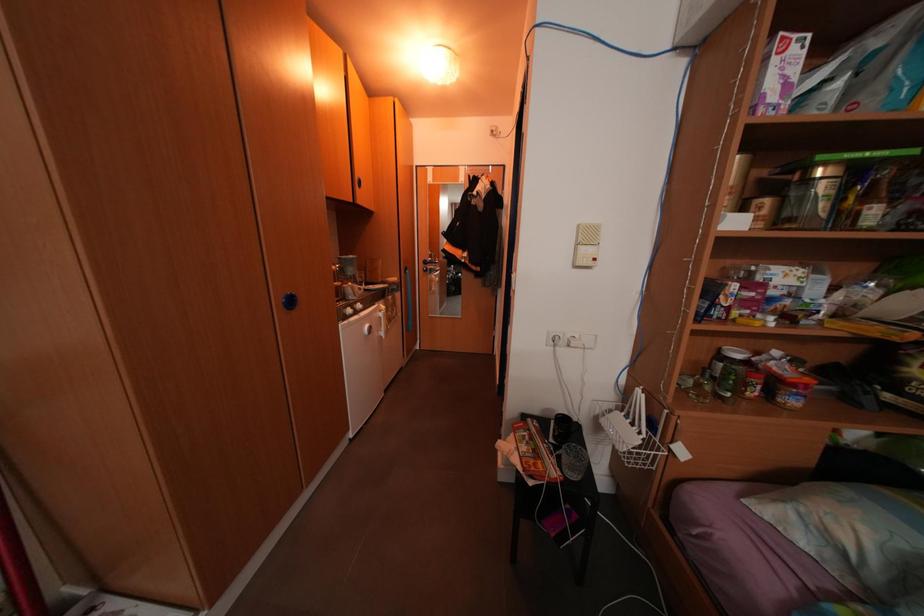
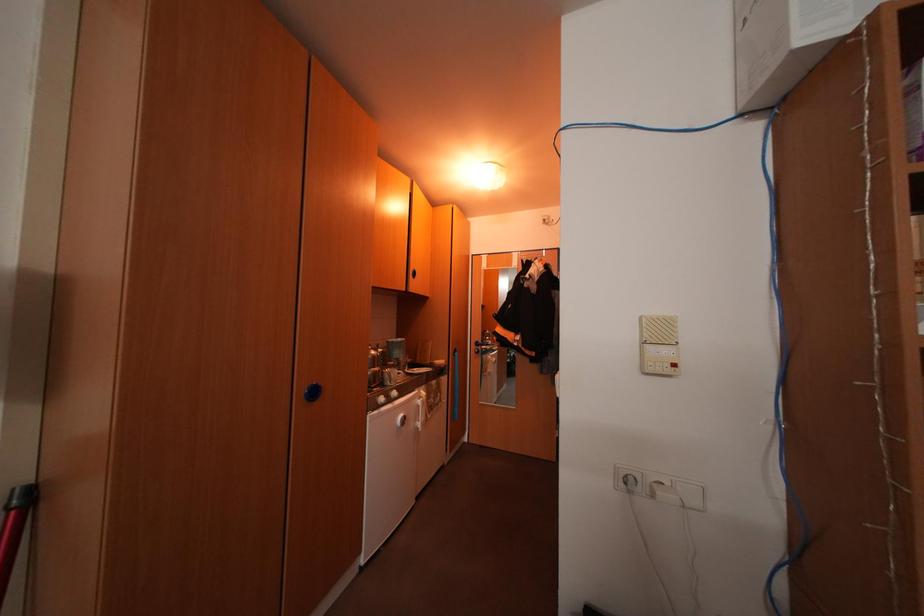
First-person continuous shooting, in which direction is the camera rotating?

The rotation direction of the camera is left-up.